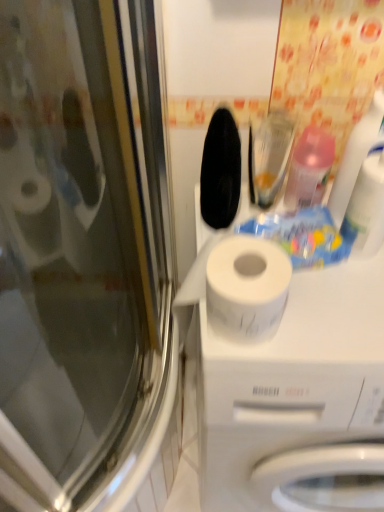
Question: Considering the relative sizes of transparent glass screen door at left and pink translucent bottle at upper right, acting as the second cleaning product starting from the right, in the image provided, is transparent glass screen door at left wider than pink translucent bottle at upper right, acting as the second cleaning product starting from the right,?

Choices:
 (A) yes
 (B) no

Answer: (A)

Question: Can you confirm if transparent glass screen door at left is taller than pink translucent bottle at upper right, acting as the second cleaning product starting from the right?

Choices:
 (A) no
 (B) yes

Answer: (B)

Question: Considering the relative sizes of transparent glass screen door at left and pink translucent bottle at upper right, acting as the second cleaning product starting from the right, in the image provided, is transparent glass screen door at left thinner than pink translucent bottle at upper right, acting as the second cleaning product starting from the right,?

Choices:
 (A) yes
 (B) no

Answer: (B)

Question: Is transparent glass screen door at left positioned behind pink translucent bottle at upper right, acting as the second cleaning product starting from the right?

Choices:
 (A) yes
 (B) no

Answer: (B)

Question: From a real-world perspective, is transparent glass screen door at left positioned over pink translucent bottle at upper right, acting as the second cleaning product starting from the right, based on gravity?

Choices:
 (A) no
 (B) yes

Answer: (A)

Question: Considering the positions of white matte toilet paper at center and translucent plastic spray bottle at upper right, the second cleaning product positioned from the left, in the image, is white matte toilet paper at center taller or shorter than translucent plastic spray bottle at upper right, the second cleaning product positioned from the left,?

Choices:
 (A) tall
 (B) short

Answer: (A)

Question: Is white matte toilet paper at center to the left or to the right of translucent plastic spray bottle at upper right, which is the first cleaning product in right-to-left order, in the image?

Choices:
 (A) right
 (B) left

Answer: (A)

Question: Is white matte toilet paper at center situated inside translucent plastic spray bottle at upper right, the second cleaning product positioned from the left, or outside?

Choices:
 (A) outside
 (B) inside

Answer: (A)

Question: From the image's perspective, is white matte toilet paper at center positioned above or below translucent plastic spray bottle at upper right, which is the first cleaning product in right-to-left order?

Choices:
 (A) below
 (B) above

Answer: (A)

Question: From a real-world perspective, is pink translucent bottle at upper right, acting as the second cleaning product starting from the right, positioned above or below transparent glass screen door at left?

Choices:
 (A) above
 (B) below

Answer: (A)

Question: In terms of height, does pink translucent bottle at upper right, acting as the second cleaning product starting from the right, look taller or shorter compared to transparent glass screen door at left?

Choices:
 (A) short
 (B) tall

Answer: (A)

Question: Is point (309, 145) positioned closer to the camera than point (112, 77)?

Choices:
 (A) closer
 (B) farther

Answer: (A)

Question: From the image's perspective, is pink translucent bottle at upper right, the 1th cleaning product viewed from the left, located above or below transparent glass screen door at left?

Choices:
 (A) below
 (B) above

Answer: (B)

Question: From the image's perspective, is pink translucent bottle at upper right, acting as the second cleaning product starting from the right, above or below translucent plastic spray bottle at upper right, the second cleaning product positioned from the left?

Choices:
 (A) above
 (B) below

Answer: (A)

Question: From a real-world perspective, is pink translucent bottle at upper right, acting as the second cleaning product starting from the right, positioned above or below translucent plastic spray bottle at upper right, which is the first cleaning product in right-to-left order?

Choices:
 (A) below
 (B) above

Answer: (A)